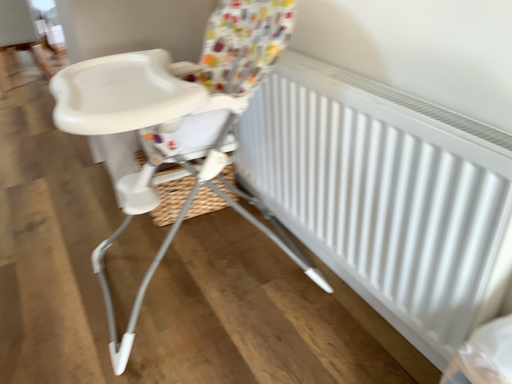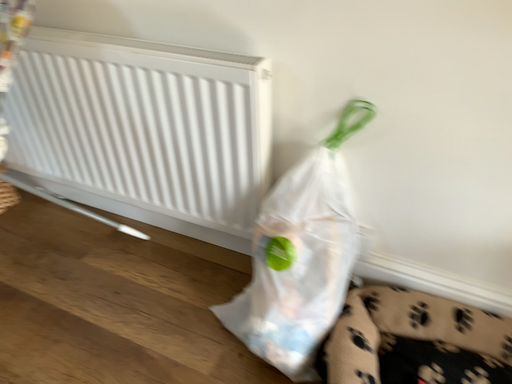
Question: How did the camera likely rotate when shooting the video?

Choices:
 (A) rotated right
 (B) rotated left

Answer: (A)